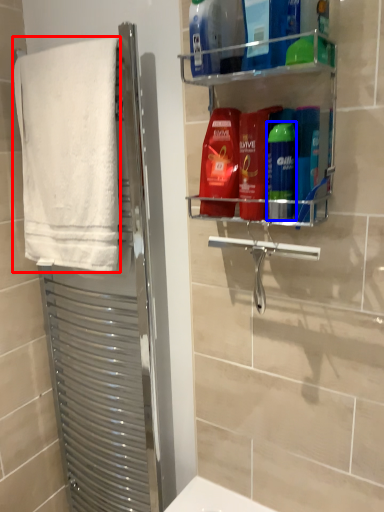
Question: Which object is closer to the camera taking this photo, towel (highlighted by a red box) or toiletry (highlighted by a blue box)?

Choices:
 (A) towel
 (B) toiletry

Answer: (B)